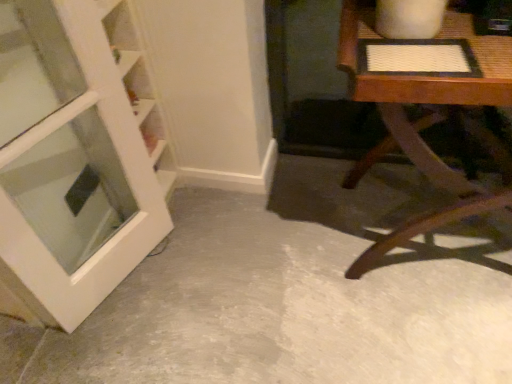
Question: From the image's perspective, is white glossy door at left positioned above or below wooden textured table at right?

Choices:
 (A) below
 (B) above

Answer: (A)

Question: Do you think white glossy door at left is within wooden textured table at right, or outside of it?

Choices:
 (A) inside
 (B) outside

Answer: (B)

Question: Estimate the real-world distances between objects in this image. Which object is closer to the white glossy door at left?

Choices:
 (A) wooden textured table at right
 (B) gray concrete floor at center

Answer: (B)

Question: Which of these objects is positioned closest to the gray concrete floor at center?

Choices:
 (A) white glossy door at left
 (B) wooden textured table at right

Answer: (B)